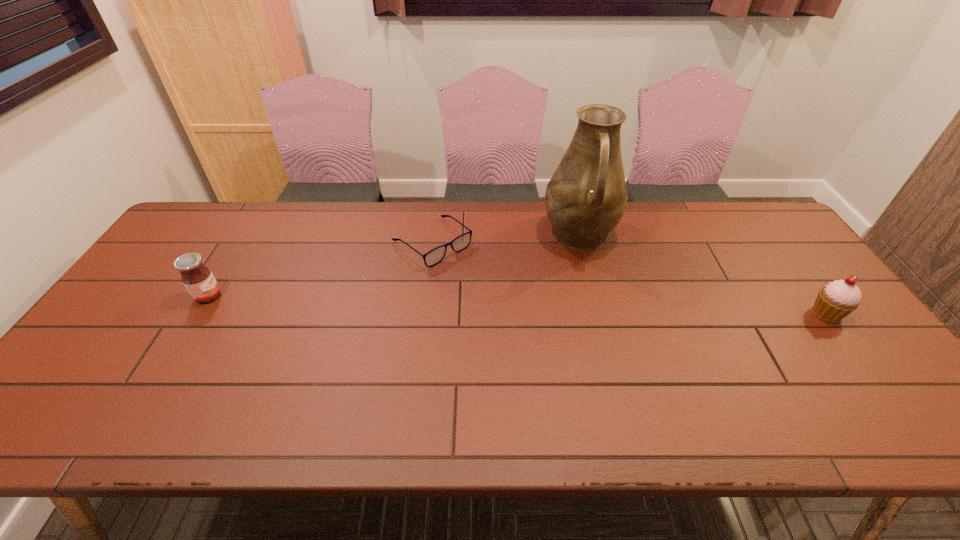
Where is `free space located on the front-facing side of the third object from right to left`? The image size is (960, 540). free space located on the front-facing side of the third object from right to left is located at coordinates (489, 289).

Identify the location of vacant space located 0.070m on the handle side of the tallest object. The height and width of the screenshot is (540, 960). (588, 281).

In order to click on blank space located 0.090m on the handle side of the tallest object in this screenshot , I will do `click(588, 287)`.

Identify the location of vacant space located 0.050m on the handle side of the tallest object. This screenshot has height=540, width=960. click(x=587, y=276).

Locate an element on the screen. The width and height of the screenshot is (960, 540). spectacles that is at the far edge is located at coordinates (436, 255).

Locate an element on the screen. The width and height of the screenshot is (960, 540). pitcher that is at the far edge is located at coordinates (586, 197).

Find the location of a particular element. The width and height of the screenshot is (960, 540). object present at the right edge is located at coordinates (835, 301).

You are a GUI agent. You are given a task and a screenshot of the screen. Output one action in this format:
    pyautogui.click(x=<x>, y=<y>)
    Task: Click on the vacant space at the far edge of the desktop
    
    Given the screenshot: What is the action you would take?
    pyautogui.click(x=347, y=220)

The height and width of the screenshot is (540, 960). I want to click on free space at the near edge of the desktop, so (622, 375).

Where is `vacant area at the left edge`? vacant area at the left edge is located at coordinates (156, 262).